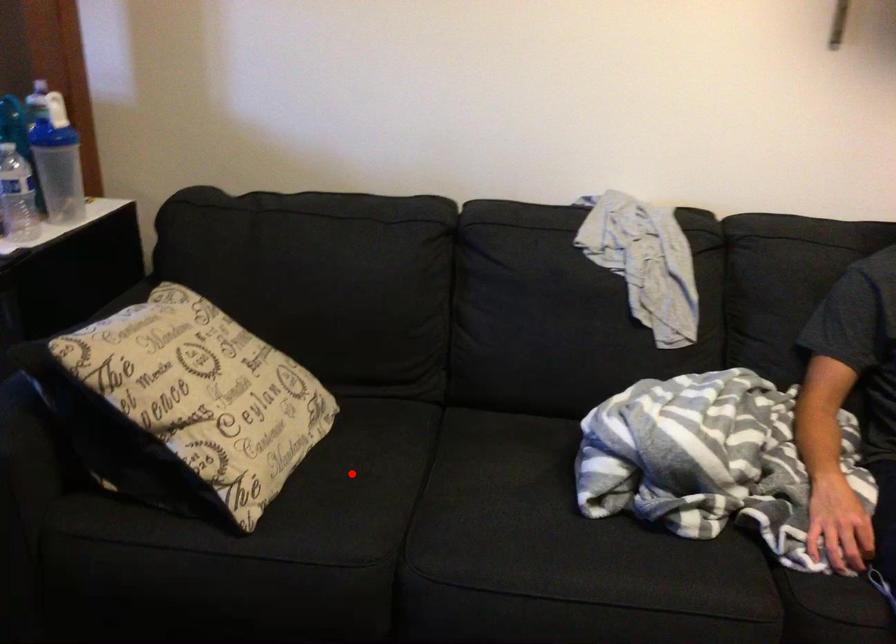
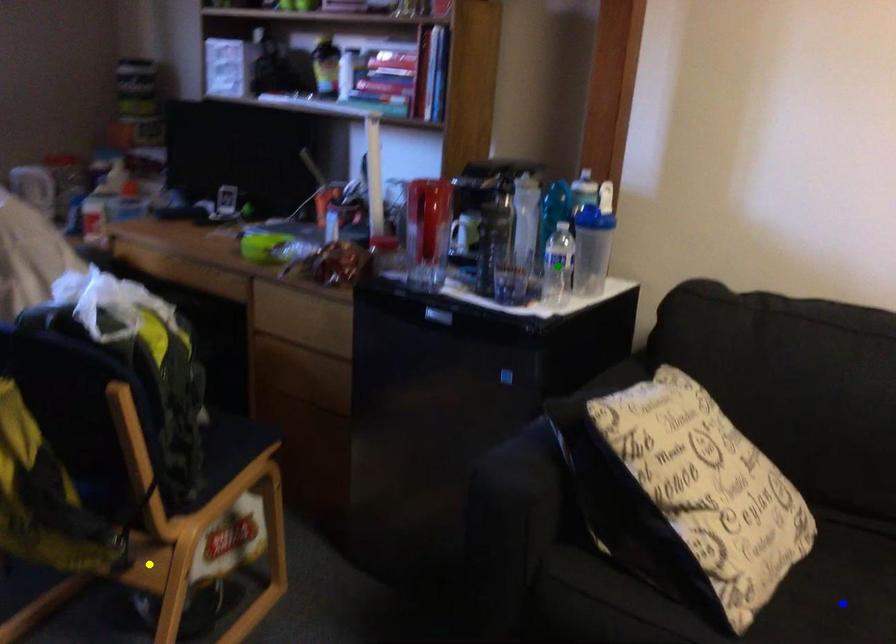
Question: I am providing you with two images of the same scene from different viewpoints. A red point is marked on the first image. You are given multiple points on the second image. Which point in image 2 represents the same 3d spot as the red point in image 1?

Choices:
 (A) yellow point
 (B) green point
 (C) blue point

Answer: (C)